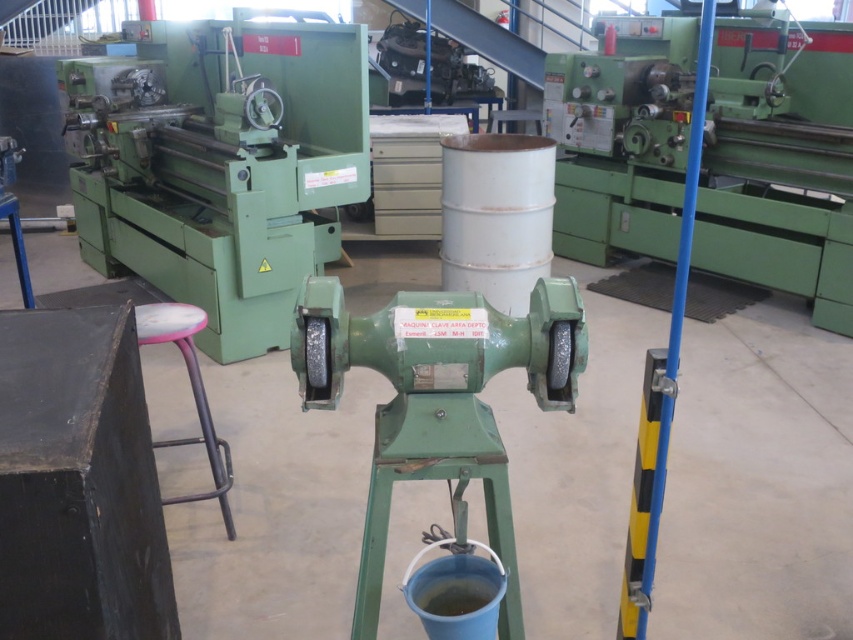
Question: Is green metallic grinding machine at center below pink plastic stool at lower left?

Choices:
 (A) yes
 (B) no

Answer: (A)

Question: Which point is closer to the camera?

Choices:
 (A) green metallic grinding machine at center
 (B) pink plastic stool at lower left

Answer: (A)

Question: Among these points, which one is nearest to the camera?

Choices:
 (A) (308, 291)
 (B) (143, 332)

Answer: (A)

Question: Is the position of green metallic grinding machine at center less distant than that of pink plastic stool at lower left?

Choices:
 (A) no
 (B) yes

Answer: (B)

Question: In this image, where is green metallic grinding machine at center located relative to pink plastic stool at lower left?

Choices:
 (A) left
 (B) right

Answer: (B)

Question: Which point is closer to the camera?

Choices:
 (A) pink plastic stool at lower left
 (B) green metallic grinding machine at center

Answer: (B)